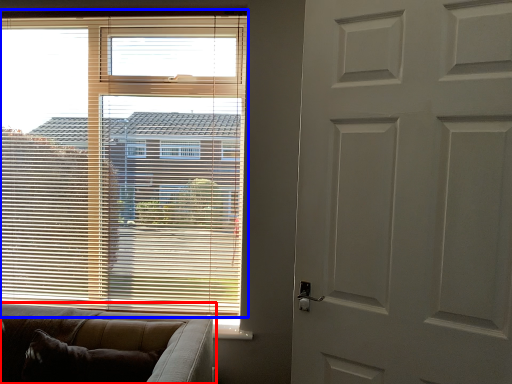
Question: Which object is closer to the camera taking this photo, studio couch (highlighted by a red box) or window blind (highlighted by a blue box)?

Choices:
 (A) studio couch
 (B) window blind

Answer: (A)